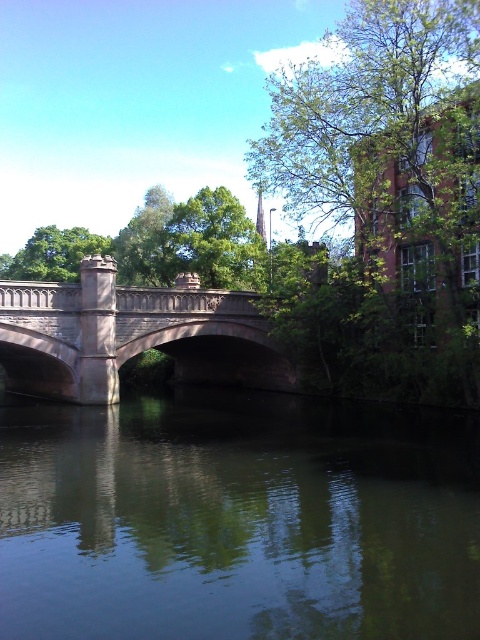
Question: Is green reflective water at center below matte stone bridge at center?

Choices:
 (A) yes
 (B) no

Answer: (A)

Question: Among these points, which one is nearest to the camera?

Choices:
 (A) (223, 522)
 (B) (1, 291)

Answer: (A)

Question: Is green reflective water at center below matte stone bridge at center?

Choices:
 (A) yes
 (B) no

Answer: (A)

Question: Which point appears farthest from the camera in this image?

Choices:
 (A) (468, 484)
 (B) (107, 317)

Answer: (B)

Question: Which point is closer to the camera taking this photo?

Choices:
 (A) (6, 600)
 (B) (51, 296)

Answer: (A)

Question: Does green reflective water at center have a lesser width compared to matte stone bridge at center?

Choices:
 (A) yes
 (B) no

Answer: (B)